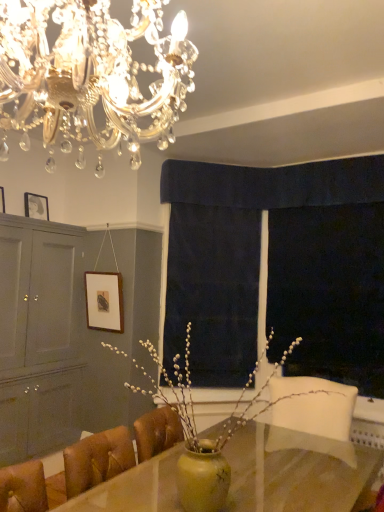
In order to click on free space above wooden picture frame at upper left, the third picture frame viewed from the top (from a real-world perspective) in this screenshot , I will do `click(100, 272)`.